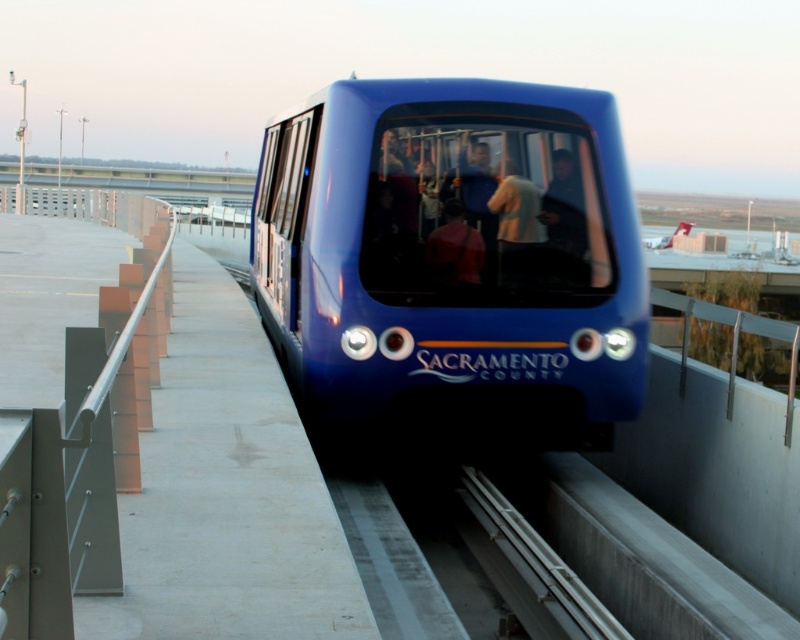
Find the location of a particular element. This screenshot has height=640, width=800. metal/smooth train track at center is located at coordinates (510, 556).

Who is more distant from viewer, (454, 484) or (452, 236)?

The point (454, 484) is behind.

I want to click on metal/smooth train track at center, so click(510, 556).

Who is more distant from viewer, (x=582, y=259) or (x=458, y=268)?

The point (x=582, y=259) is more distant.

Identify the location of blue glossy train at center. (454, 285).

Is point (609, 205) less distant than point (578, 588)?

No, (609, 205) is further to viewer.

Can you confirm if blue glossy train at center is positioned to the left of metal/smooth train track at center?

Indeed, blue glossy train at center is positioned on the left side of metal/smooth train track at center.

The image size is (800, 640). I want to click on blue glossy train at center, so click(454, 285).